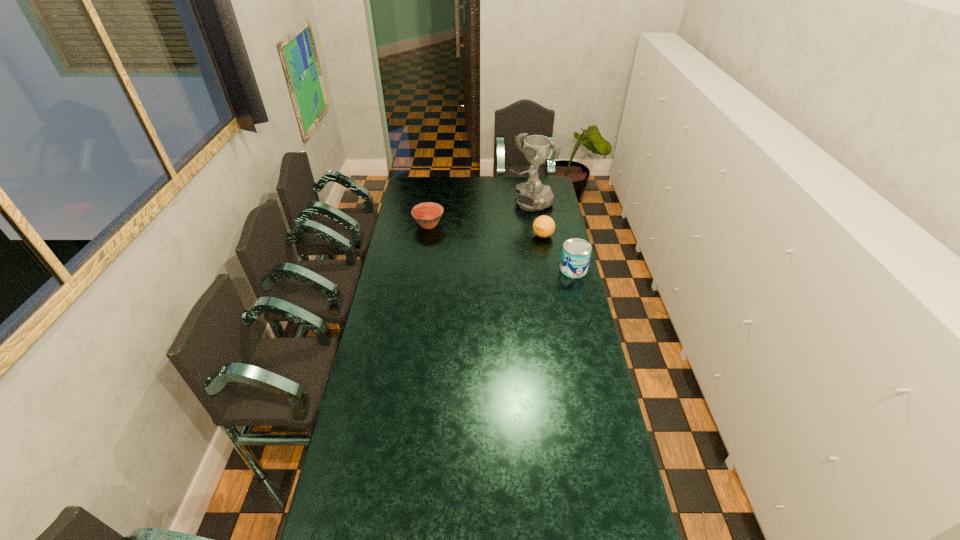
Locate an element on the screen. Image resolution: width=960 pixels, height=540 pixels. object that is positioned at the far right corner is located at coordinates (532, 195).

Where is `vacant space at the far edge of the desktop`? This screenshot has width=960, height=540. vacant space at the far edge of the desktop is located at coordinates (444, 187).

You are a GUI agent. You are given a task and a screenshot of the screen. Output one action in this format:
    pyautogui.click(x=<x>, y=<y>)
    Task: Click on the blank area at the near edge
    
    Given the screenshot: What is the action you would take?
    pyautogui.click(x=493, y=524)

Where is `free spot at the left edge of the desktop`? Image resolution: width=960 pixels, height=540 pixels. free spot at the left edge of the desktop is located at coordinates (395, 378).

The image size is (960, 540). I want to click on free point at the right edge, so pyautogui.click(x=567, y=361).

Where is `vacant space at the far right corner of the desktop`? vacant space at the far right corner of the desktop is located at coordinates click(x=550, y=177).

Locate an element on the screen. This screenshot has height=540, width=960. unoccupied position between the farthest object and the bowl is located at coordinates (479, 214).

This screenshot has height=540, width=960. I want to click on empty location between the third tallest object and the can, so click(558, 253).

Where is `free space between the can and the tallest object`? This screenshot has height=540, width=960. free space between the can and the tallest object is located at coordinates (552, 236).

At what (x,y) coordinates should I click in order to perform the action: click on unoccupied position between the can and the tallest object. Please return your answer as a coordinate pair (x, y). Looking at the image, I should click on (552, 236).